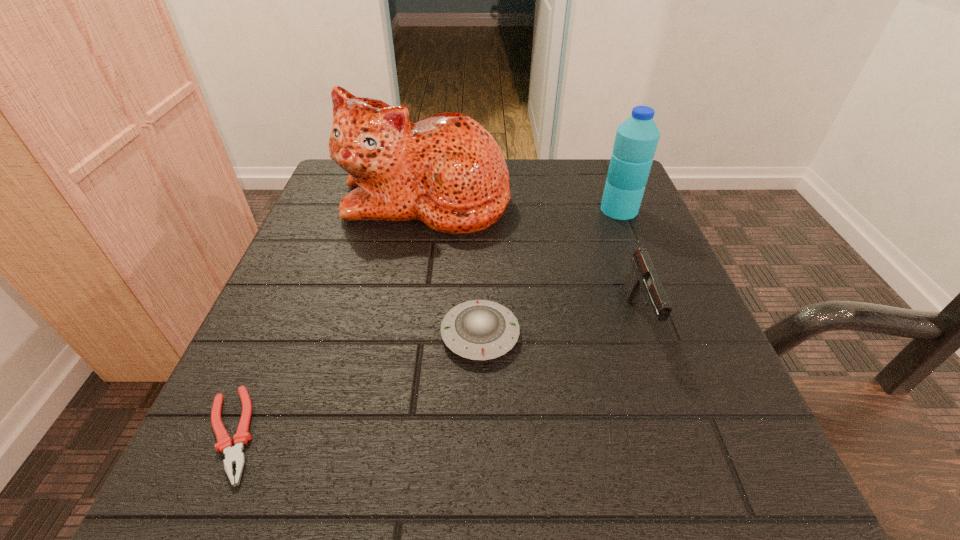
Where is `empty space that is in between the cat and the water bottle`? The width and height of the screenshot is (960, 540). empty space that is in between the cat and the water bottle is located at coordinates (522, 205).

The height and width of the screenshot is (540, 960). I want to click on free space between the cat and the water bottle, so click(522, 205).

You are a GUI agent. You are given a task and a screenshot of the screen. Output one action in this format:
    pyautogui.click(x=<x>, y=<y>)
    Task: Click on the empty space between the saucer and the third shortest object
    The height and width of the screenshot is (540, 960).
    Given the screenshot: What is the action you would take?
    pyautogui.click(x=560, y=326)

You are a GUI agent. You are given a task and a screenshot of the screen. Output one action in this format:
    pyautogui.click(x=<x>, y=<y>)
    Task: Click on the empty space that is in between the water bottle and the pistol
    
    Given the screenshot: What is the action you would take?
    pyautogui.click(x=629, y=264)

At what (x,y) coordinates should I click in order to perform the action: click on vacant area that lies between the nearest object and the third tallest object. Please return your answer as a coordinate pair (x, y). Image resolution: width=960 pixels, height=540 pixels. Looking at the image, I should click on (435, 376).

I want to click on free spot between the cat and the nearest object, so click(x=328, y=317).

I want to click on object that is the fourth closest to the pliers, so click(x=636, y=140).

Where is `object that is the third closest to the cat`? The width and height of the screenshot is (960, 540). object that is the third closest to the cat is located at coordinates pos(643,280).

The height and width of the screenshot is (540, 960). Identify the location of free spot that satisfies the following two spatial constraints: 1. on the face of the cat; 2. on the left side of the saucer. tap(404, 334).